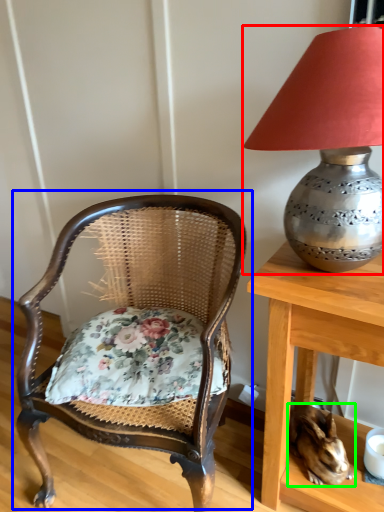
Question: Based on their relative distances, which object is nearer to lamp (highlighted by a red box)? Choose from chair (highlighted by a blue box) and rabbit (highlighted by a green box).

Choices:
 (A) chair
 (B) rabbit

Answer: (A)